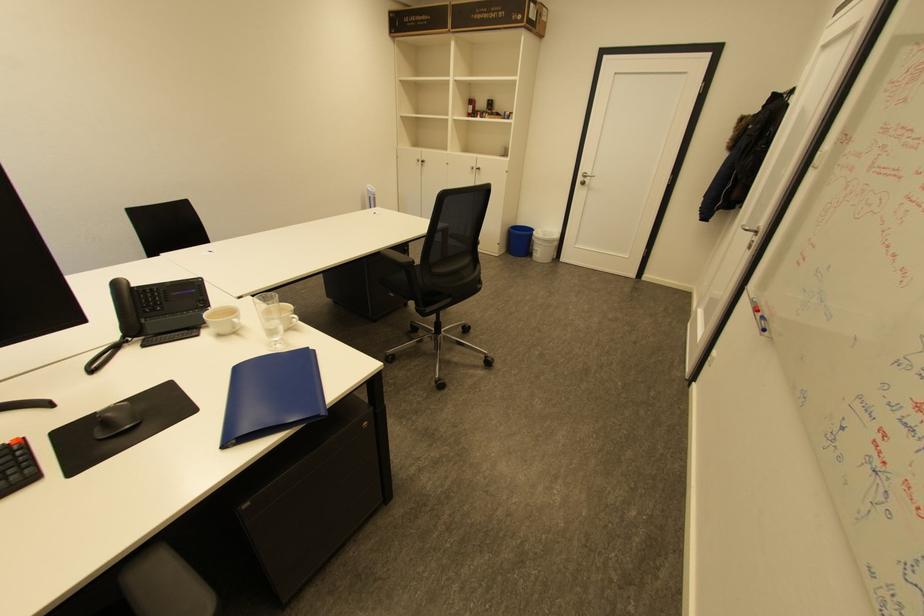
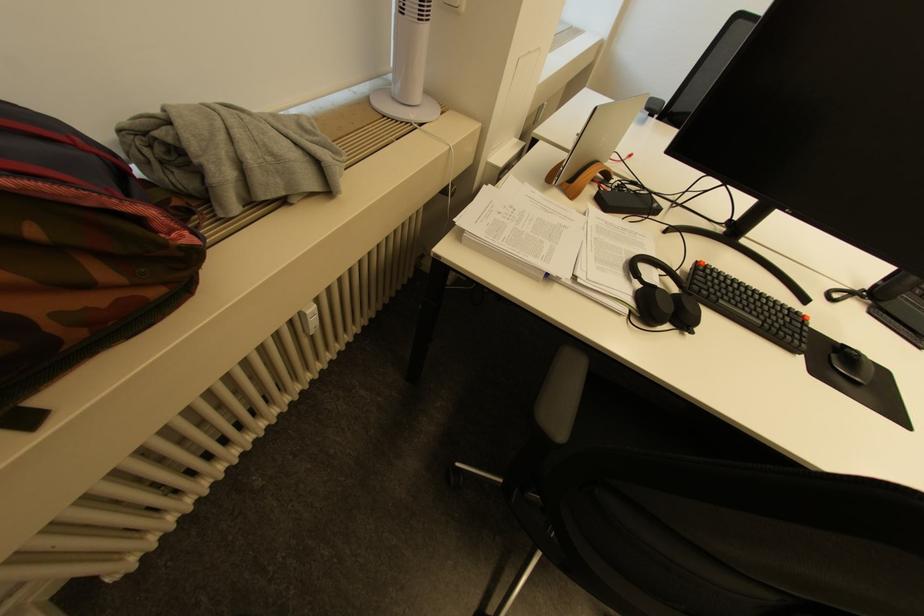
The point at (41, 477) is marked in the first image. Where is the corresponding point in the second image?

(800, 351)